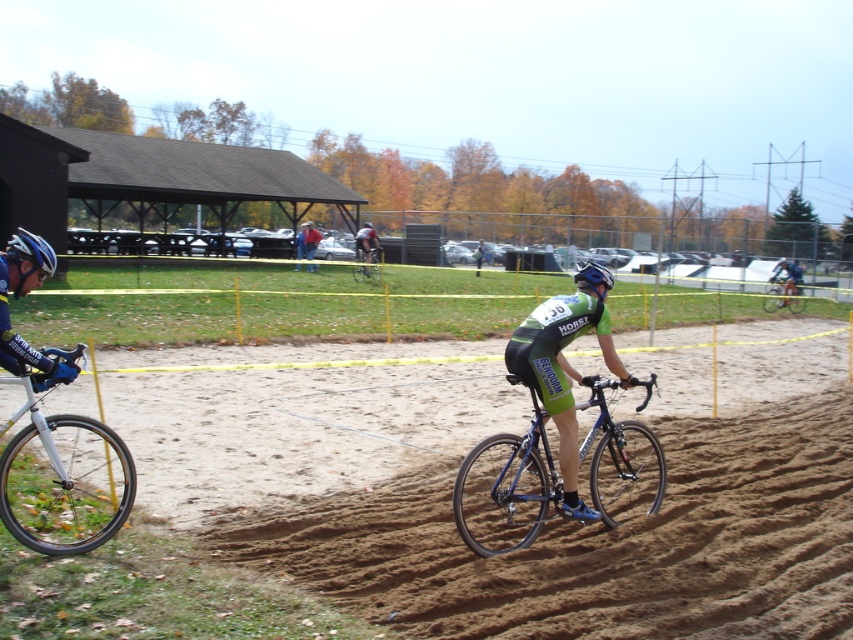
Consider the image. You are a photographer at the cyclocross event. You want to capture a photo of the denim jacket at center and the brown sandy dirt at center in the same frame. Based on their positions, which object should be placed lower in the photo?

The brown sandy dirt at center should be placed lower in the photo because it is located below the denim jacket at center.

You are a photographer at the cyclocross race. You want to capture a closeup shot of the silver metallic bicycle wheel at left and the shiny blue helmet at left. Which object should you zoom in more on to ensure both are in focus?

The silver metallic bicycle wheel at left has a lesser width compared to the shiny blue helmet at left, so you should zoom in more on the shiny blue helmet at left to ensure both are in focus.